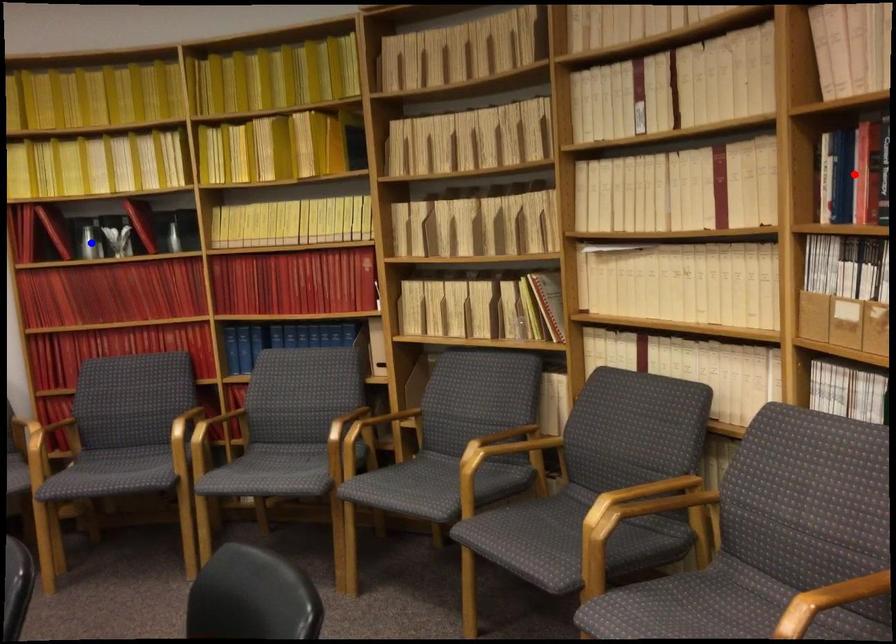
Question: Two points are marked on the image. Which point is closer to the camera?

Choices:
 (A) Blue point is closer.
 (B) Red point is closer.

Answer: (B)